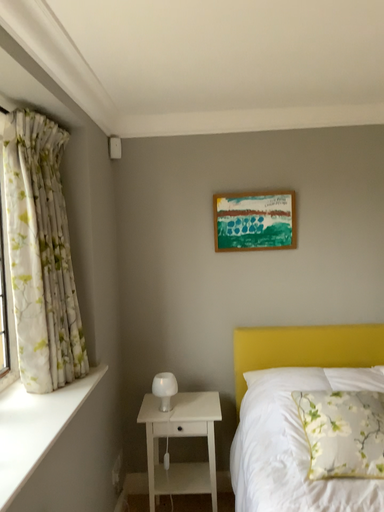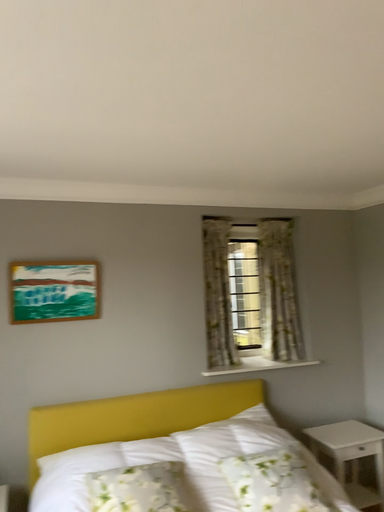
Question: How did the camera likely rotate when shooting the video?

Choices:
 (A) rotated left
 (B) rotated right

Answer: (B)